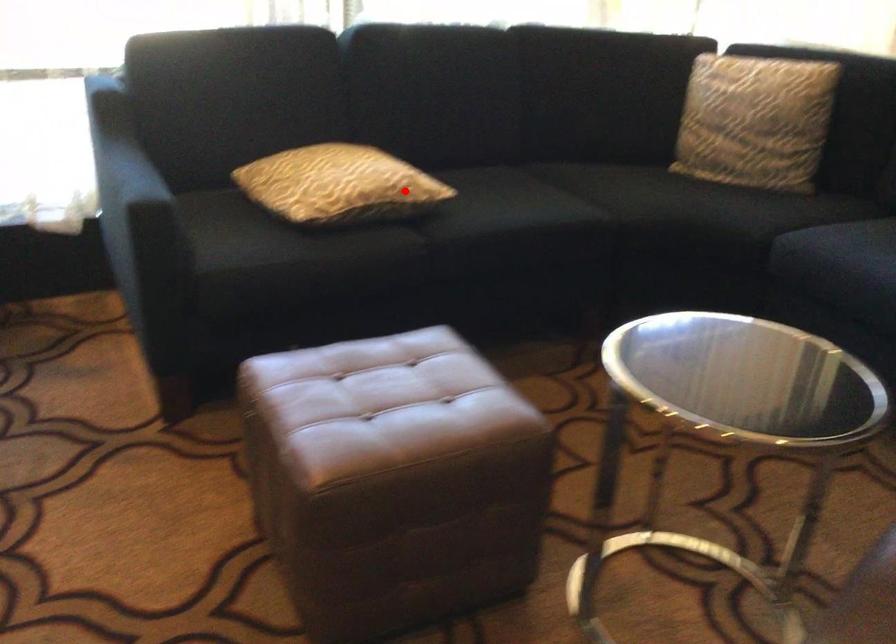
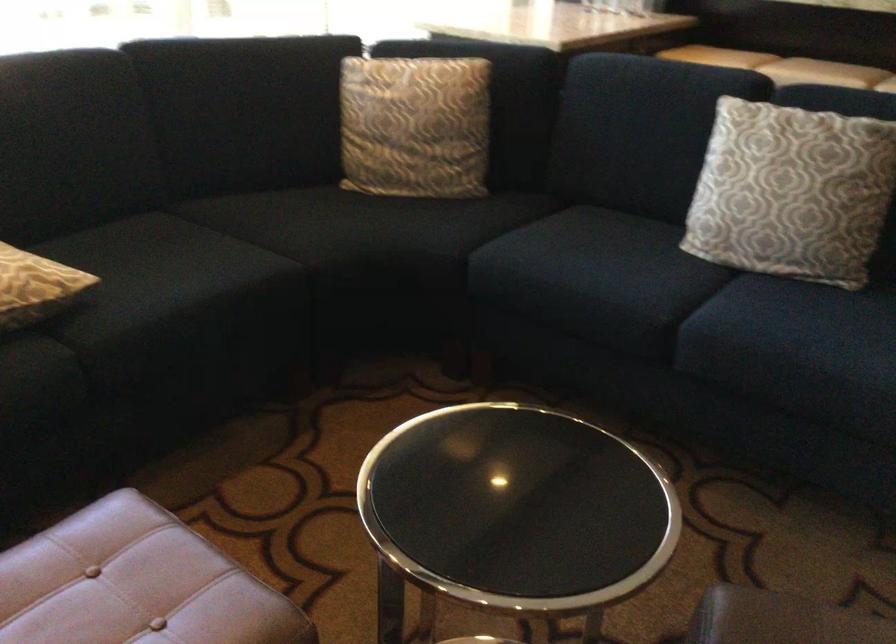
Find the pixel in the second image that matches the highlighted location in the first image.

(35, 287)